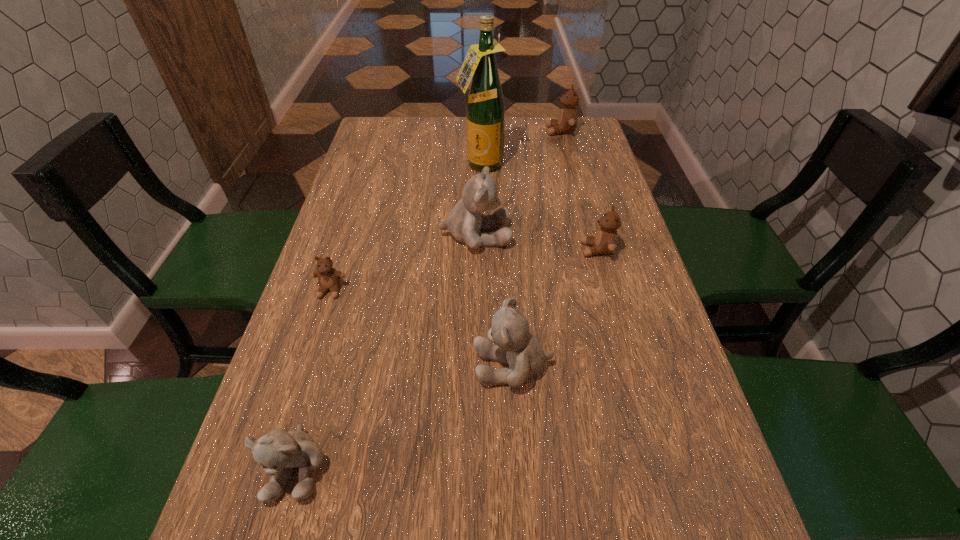
Locate an element on the screen. The image size is (960, 540). vacant region located 0.160m on the face of the second nearest teddy bear is located at coordinates (390, 366).

The height and width of the screenshot is (540, 960). Find the location of `free region located on the front-facing side of the second farthest brown teddy bear`. free region located on the front-facing side of the second farthest brown teddy bear is located at coordinates (548, 249).

Locate an element on the screen. This screenshot has width=960, height=540. free location located on the front-facing side of the second farthest brown teddy bear is located at coordinates (523, 249).

At what (x,y) coordinates should I click in order to perform the action: click on vacant area situated on the front-facing side of the second farthest brown teddy bear. Please return your answer as a coordinate pair (x, y). This screenshot has height=540, width=960. Looking at the image, I should click on (487, 249).

This screenshot has height=540, width=960. I want to click on free spot located 0.110m on the front-facing side of the third nearest teddy bear, so click(x=314, y=341).

Locate an element on the screen. Image resolution: width=960 pixels, height=540 pixels. object that is positioned at the far edge is located at coordinates (567, 121).

I want to click on object positioned at the far right corner, so click(x=567, y=121).

Locate an element on the screen. free spot at the far edge of the desktop is located at coordinates (447, 144).

Where is `free region at the left edge of the desktop`? free region at the left edge of the desktop is located at coordinates (374, 197).

What are the coordinates of `free space at the right edge` in the screenshot? It's located at [656, 344].